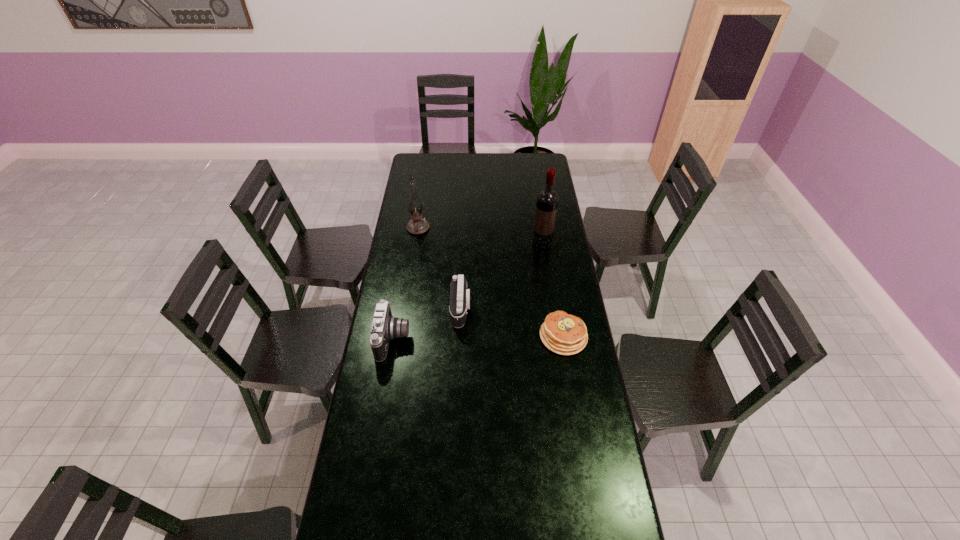
The image size is (960, 540). I want to click on the third closest object to the fourth shortest object, so click(385, 327).

Identify the location of object that ranks as the second closest to the second farthest object. (564, 334).

At what (x,y) coordinates should I click in order to perform the action: click on free point that satisfies the following two spatial constraints: 1. on the front side of the shortest object; 2. on the front-facing side of the left camera. Please return your answer as a coordinate pair (x, y). This screenshot has height=540, width=960. Looking at the image, I should click on (564, 339).